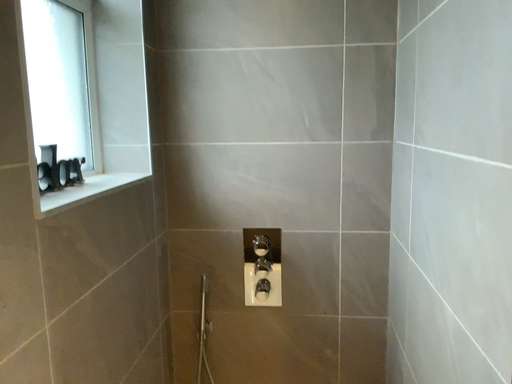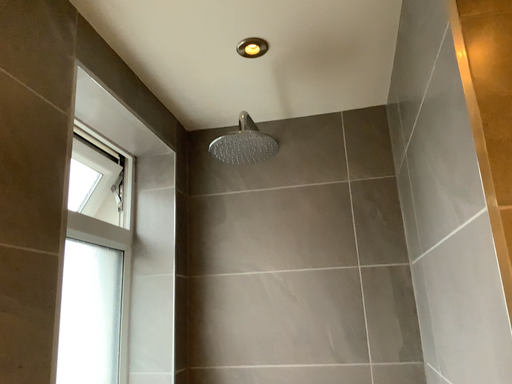
Question: Which way did the camera rotate in the video?

Choices:
 (A) rotated upward
 (B) rotated downward

Answer: (A)